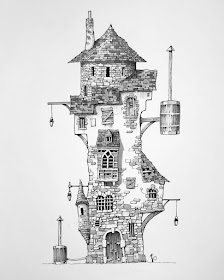
Identify the location of window. The height and width of the screenshot is (280, 224). (111, 202).